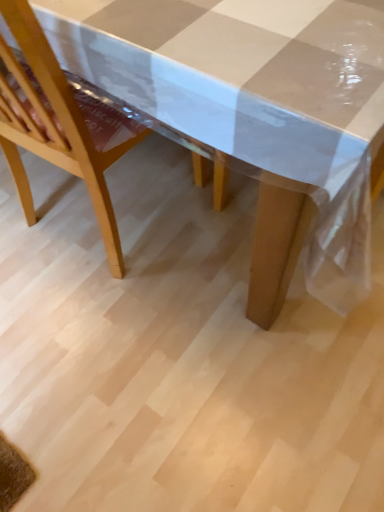
Question: From the image's perspective, is light wood chair at center positioned above or below transparent plastic picnic table at center?

Choices:
 (A) above
 (B) below

Answer: (B)

Question: From a real-world perspective, is light wood chair at center above or below transparent plastic picnic table at center?

Choices:
 (A) below
 (B) above

Answer: (B)

Question: Do you think light wood chair at center is within transparent plastic picnic table at center, or outside of it?

Choices:
 (A) outside
 (B) inside

Answer: (B)

Question: Looking at the image, does transparent plastic picnic table at center seem bigger or smaller compared to light wood chair at center?

Choices:
 (A) big
 (B) small

Answer: (A)

Question: Which is correct: transparent plastic picnic table at center is inside light wood chair at center, or outside of it?

Choices:
 (A) inside
 (B) outside

Answer: (B)

Question: From the image's perspective, is transparent plastic picnic table at center positioned above or below light wood chair at center?

Choices:
 (A) below
 (B) above

Answer: (B)

Question: From a real-world perspective, is transparent plastic picnic table at center physically located above or below light wood chair at center?

Choices:
 (A) above
 (B) below

Answer: (B)